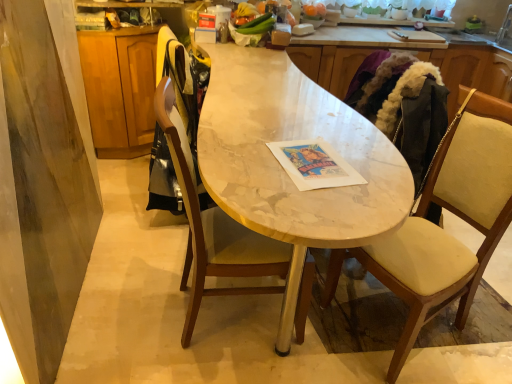
Question: Considering the positions of beige fabric chair at right, which is the 1th chair in right-to-left order, and white marble countertop at center in the image, is beige fabric chair at right, which is the 1th chair in right-to-left order, wider or thinner than white marble countertop at center?

Choices:
 (A) wide
 (B) thin

Answer: (B)

Question: Is beige fabric chair at right, the second chair from the left, situated inside white marble countertop at center or outside?

Choices:
 (A) inside
 (B) outside

Answer: (B)

Question: Which is farther from the wooden cabinet at left, which is the second cabinetry from right to left?

Choices:
 (A) silver metallic faucet at upper right
 (B) white marble countertop at center
 (C) light brown wood cabinet at upper right, acting as the first cabinetry starting from the right
 (D) marble table at center
 (E) wooden chair at center, the 2th chair when ordered from right to left

Answer: (A)

Question: Considering the real-world distances, which object is closest to the wooden cabinet at left, which is the second cabinetry from right to left?

Choices:
 (A) wooden chair at center, arranged as the first chair when viewed from the left
 (B) silver metallic faucet at upper right
 (C) light brown wood cabinet at upper right, acting as the first cabinetry starting from the right
 (D) beige fabric chair at right, the second chair from the left
 (E) marble table at center

Answer: (E)